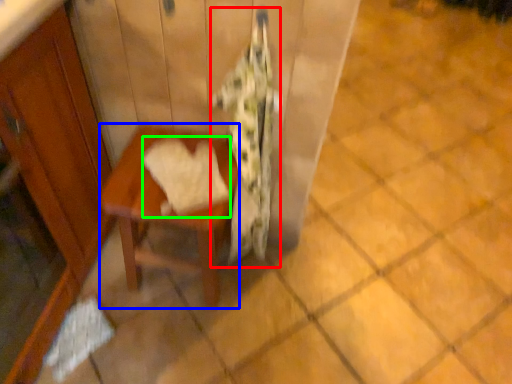
Question: Considering the real-world distances, which object is closest to blanket (highlighted by a red box)? table (highlighted by a blue box) or bath towel (highlighted by a green box).

Choices:
 (A) table
 (B) bath towel

Answer: (A)